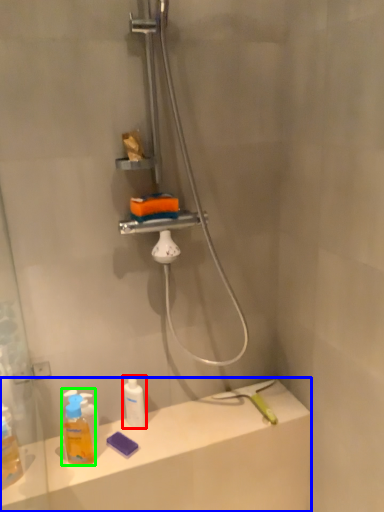
Question: Estimate the real-world distances between objects in this image. Which object is closer to mouthwash (highlighted by a red box), counter top (highlighted by a blue box) or mouthwash (highlighted by a green box)?

Choices:
 (A) counter top
 (B) mouthwash

Answer: (B)